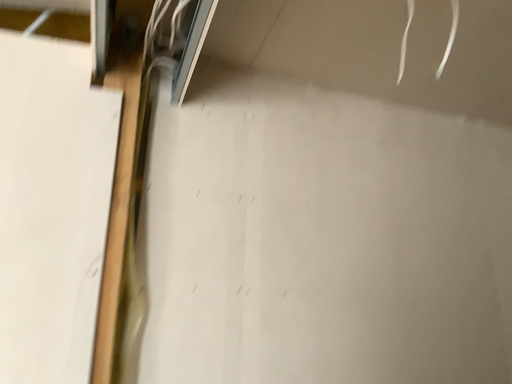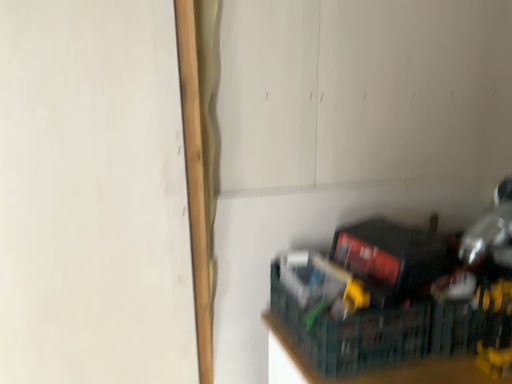
Question: How did the camera likely rotate when shooting the video?

Choices:
 (A) rotated upward
 (B) rotated downward

Answer: (B)